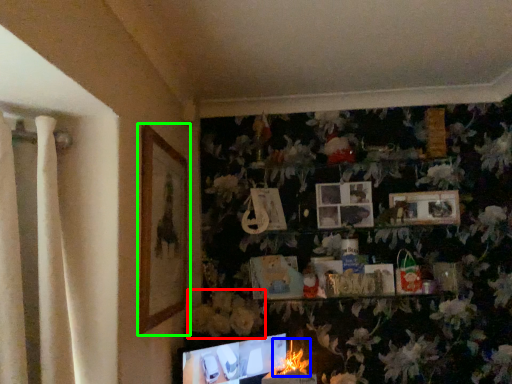
Question: Which is nearer to the flower (highlighted by a red box)? flower (highlighted by a blue box) or picture frame (highlighted by a green box).

Choices:
 (A) flower
 (B) picture frame

Answer: (A)